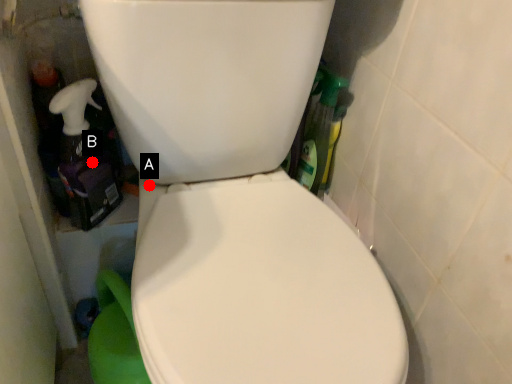
Question: Two points are circled on the image, labeled by A and B beside each circle. Which of the following is the farthest from the observer?

Choices:
 (A) A is further
 (B) B is further

Answer: (B)